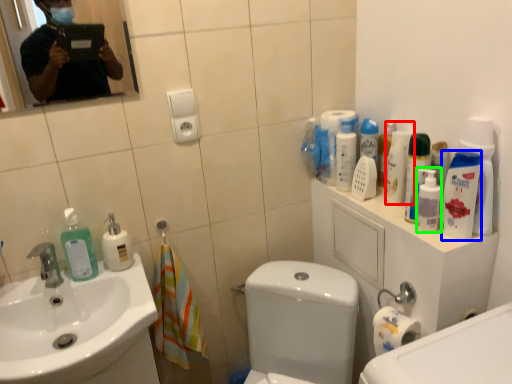
Question: Which object is the closest to the cleaning product (highlighted by a red box)? Choose among these: mouthwash (highlighted by a blue box) or cleaning product (highlighted by a green box).

Choices:
 (A) mouthwash
 (B) cleaning product

Answer: (B)